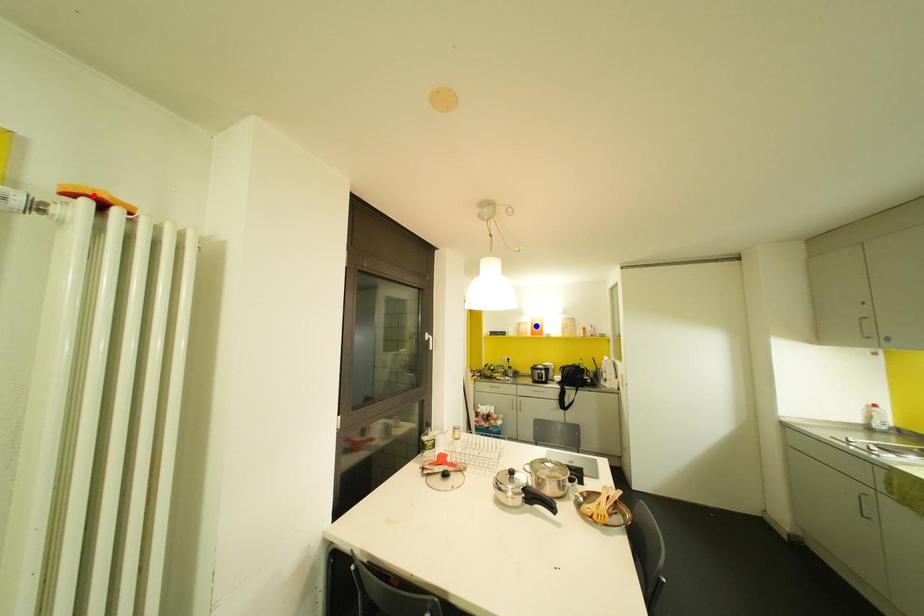
Question: Two points are marked on the image. Which point is closer to the camera?

Choices:
 (A) Blue point is closer.
 (B) Red point is closer.

Answer: (B)